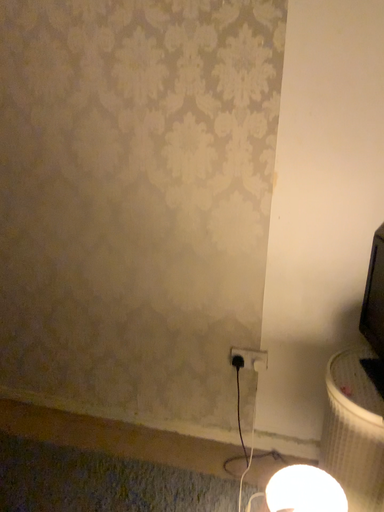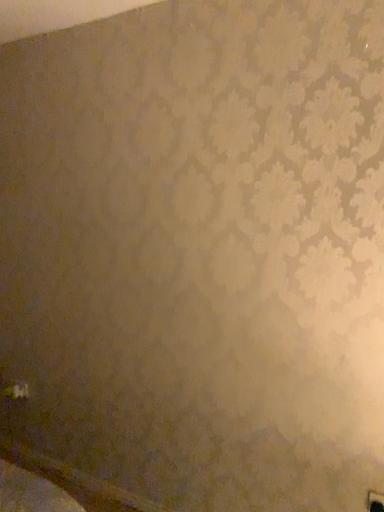
Question: Which way did the camera rotate in the video?

Choices:
 (A) rotated downward
 (B) rotated upward

Answer: (B)